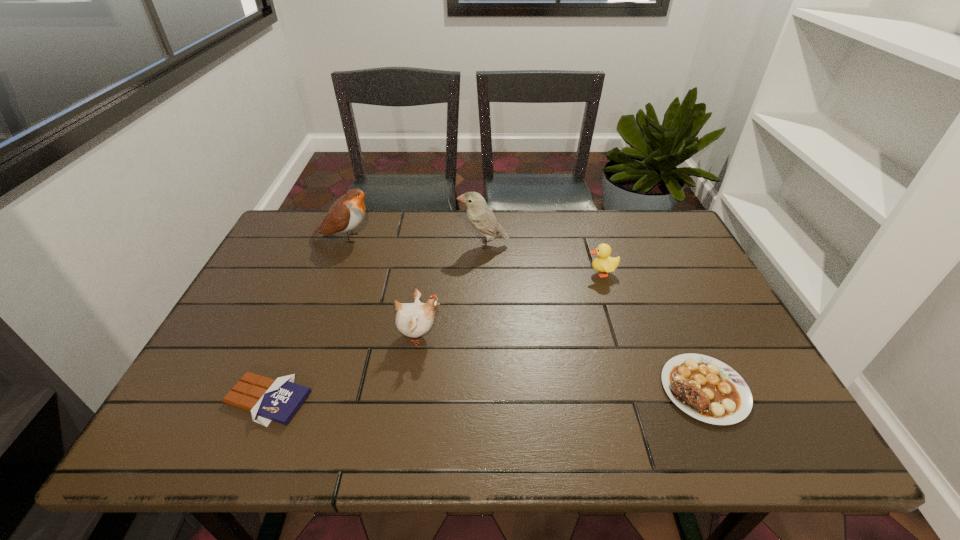
Locate an element on the screen. This screenshot has height=540, width=960. vacant space that satisfies the following two spatial constraints: 1. at the face of the leftmost bird; 2. on the back side of the fifth tallest object is located at coordinates (285, 389).

What are the coordinates of `vacant space that satisfies the following two spatial constraints: 1. at the beak of the steak; 2. on the left side of the shortest bird` in the screenshot? It's located at (411, 389).

This screenshot has width=960, height=540. In order to click on vacant area in the image that satisfies the following two spatial constraints: 1. at the face of the fourth object from left to right; 2. on the right side of the rightmost object in this screenshot , I will do `click(485, 389)`.

You are a GUI agent. You are given a task and a screenshot of the screen. Output one action in this format:
    pyautogui.click(x=<x>, y=<y>)
    Task: Click on the vacant space that satisfies the following two spatial constraints: 1. at the face of the leftmost bird; 2. on the back side of the second shortest object
    
    Given the screenshot: What is the action you would take?
    pyautogui.click(x=285, y=389)

I want to click on vacant space that satisfies the following two spatial constraints: 1. at the face of the leftmost bird; 2. on the front side of the shortest object, so click(281, 400).